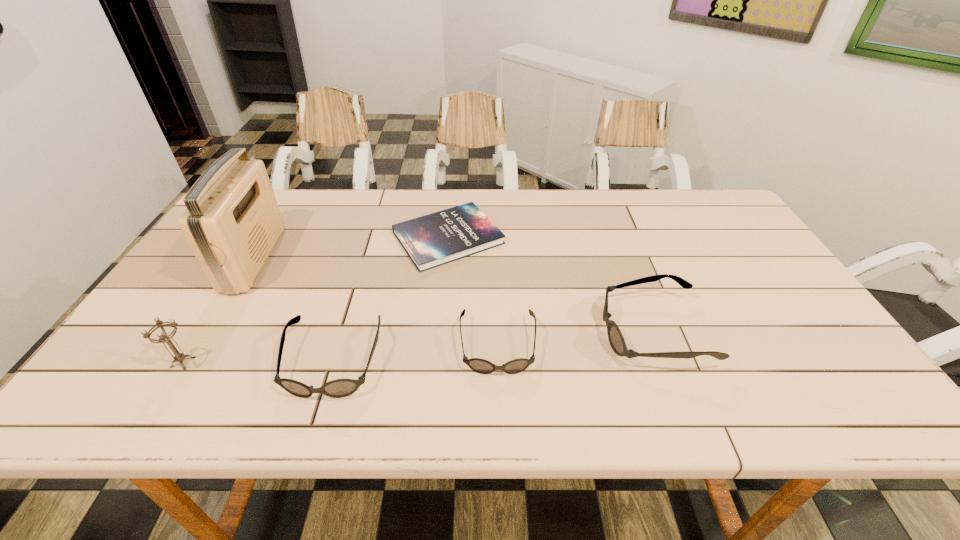
You are a GUI agent. You are given a task and a screenshot of the screen. Output one action in this format:
    pyautogui.click(x=<x>, y=<y>)
    Task: Click on the leftmost sunglasses
    Image resolution: width=960 pixels, height=540 pixels.
    Given the screenshot: What is the action you would take?
    pyautogui.click(x=339, y=388)

You are a GUI agent. You are given a task and a screenshot of the screen. Output one action in this format:
    pyautogui.click(x=<x>, y=<y>)
    Task: Click on the fourth tallest object
    
    Given the screenshot: What is the action you would take?
    pyautogui.click(x=339, y=388)

This screenshot has width=960, height=540. In order to click on the second sunglasses from left to right in this screenshot , I will do `click(482, 366)`.

Locate an element on the screen. Image resolution: width=960 pixels, height=540 pixels. the shortest sunglasses is located at coordinates (482, 366).

Image resolution: width=960 pixels, height=540 pixels. I want to click on the rightmost sunglasses, so click(x=616, y=339).

Where is `the shortest object`? This screenshot has width=960, height=540. the shortest object is located at coordinates (432, 240).

What are the coordinates of `the tallest object` in the screenshot? It's located at (232, 222).

Locate an element on the screen. This screenshot has height=540, width=960. candle holder is located at coordinates (163, 337).

In order to click on free space located on the lenses of the rightmost sunglasses in this screenshot , I will do `click(514, 332)`.

What are the coordinates of `vacant area located on the lenses of the rightmost sunglasses` in the screenshot? It's located at (496, 332).